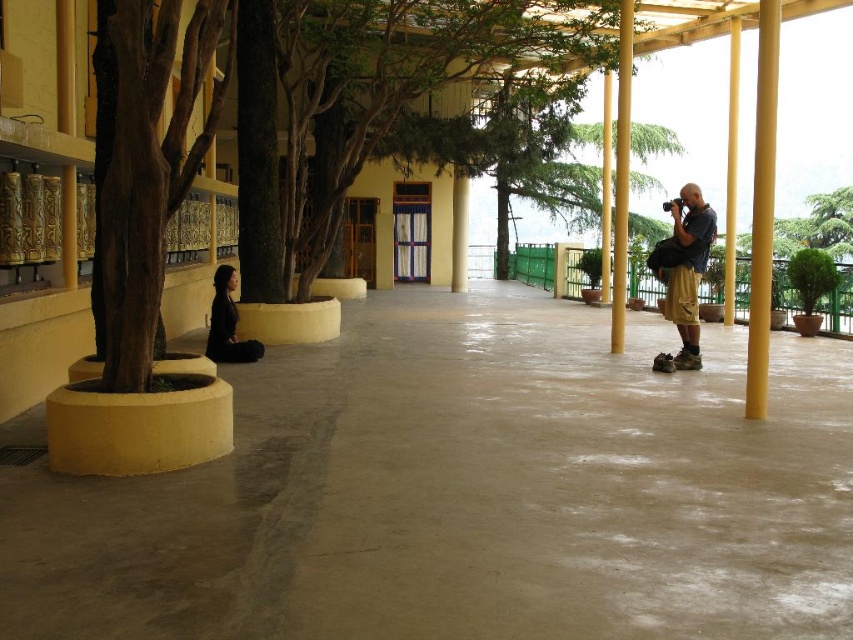
Based on the photo, you are a maintenance worker assigned to water the green leafy tree at center and the yellow polished wood pillar at right. You have a hose that can reach 8 meters. Starting from the pillar, can you water the tree without moving the hose? Please explain your reasoning.

The distance between the green leafy tree at center and the yellow polished wood pillar at right is 8.11 meters. Since the hose can only reach 8 meters, you would need to move the hose closer to water the tree, as the current distance exceeds the hose length.

You are a visitor standing at the entrance of the walkway. You want to take a photo of both the brown rough bark tree at left and the yellow polished wood pillar at right. Can you see both objects clearly in the same frame without any obstruction?

The brown rough bark tree at left is in front of the yellow polished wood pillar at right, so the tree may block part of the pillar in your photo. Adjust your angle to ensure both are visible.